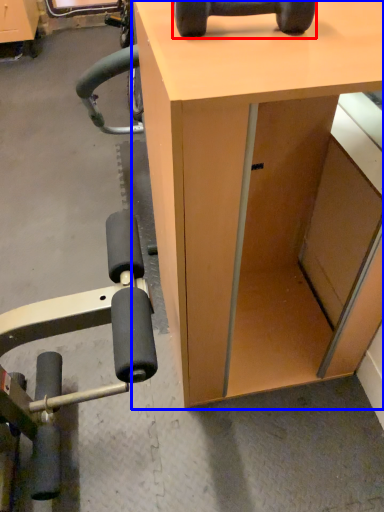
Question: Which of the following is the closest to the observer, dumbbell (highlighted by a red box) or desk (highlighted by a blue box)?

Choices:
 (A) dumbbell
 (B) desk

Answer: (B)